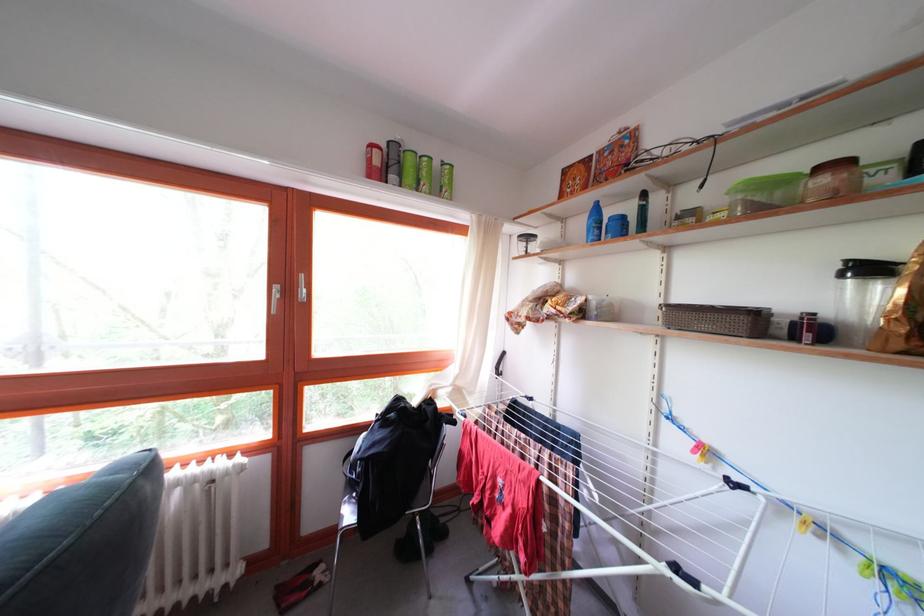
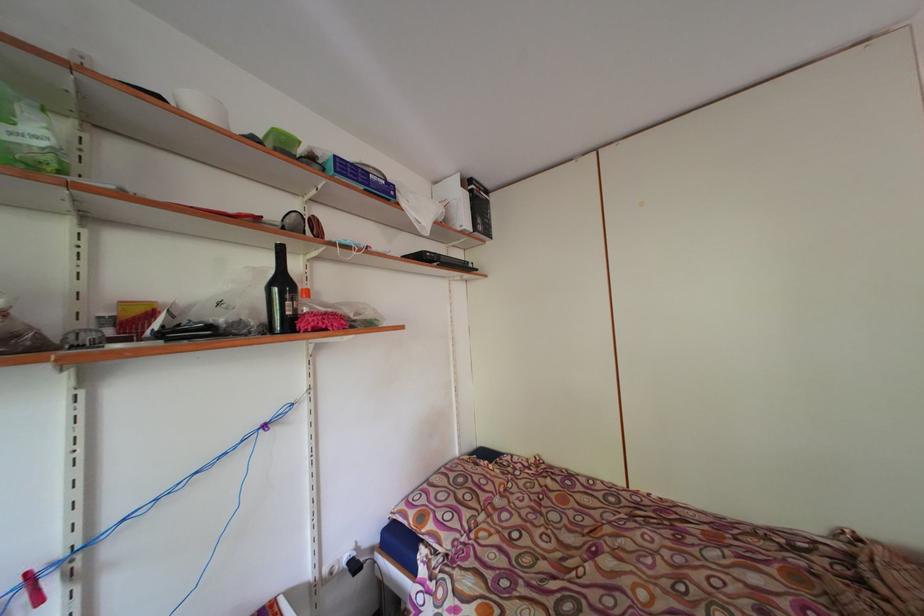
Question: The camera is either moving clockwise (left) or counter-clockwise (right) around the object. The first image is from the beginning of the video and the second image is from the end. Is the camera moving left or right when shooting the video?

Choices:
 (A) Left
 (B) Right

Answer: (A)